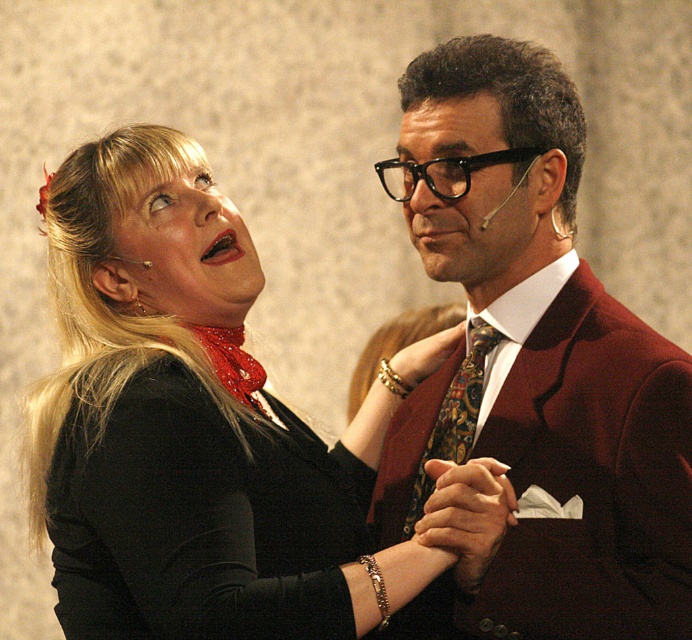
Consider the image. You are an audience member sitting in the front row of a theater. You notice two items on stage that you need to describe to a friend who can only see in black and white. The items are the black matte blouse at upper left and the multicolored patterned tie at center. Which item is more to the left?

The black matte blouse at upper left is more to the left side of the multicolored patterned tie at center.

In the image, there is a velvet burgundy suit at center. Where exactly is it located in terms of coordinates?

The velvet burgundy suit at center is located at point (531,369).

You are an event planner arranging a stage for a performance. You have a velvet burgundy suit that needs to be placed exactly at point (531, 369). Based on the scene description, where should you position the velvet burgundy suit?

The velvet burgundy suit at center should be placed at point (531, 369) as specified.